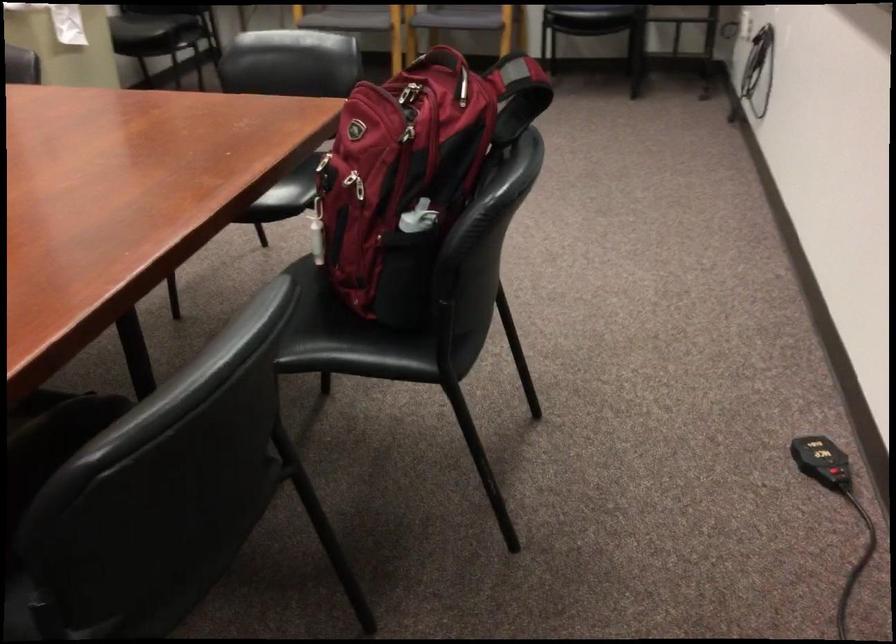
You are a GUI agent. You are given a task and a screenshot of the screen. Output one action in this format:
    pyautogui.click(x=<x>, y=<y>)
    Task: Click on the backpack carry handle
    
    Given the screenshot: What is the action you would take?
    pyautogui.click(x=408, y=97)